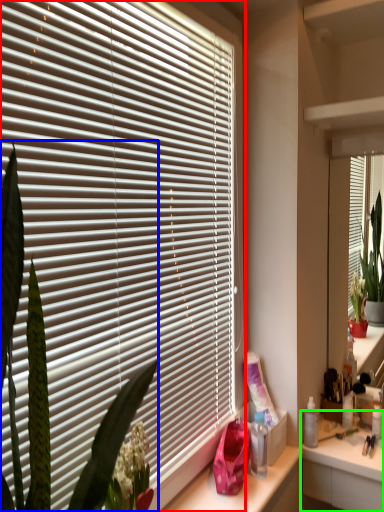
Question: Which is nearer to the window blind (highlighted by a red box)? plant (highlighted by a blue box) or counter (highlighted by a green box).

Choices:
 (A) plant
 (B) counter

Answer: (A)